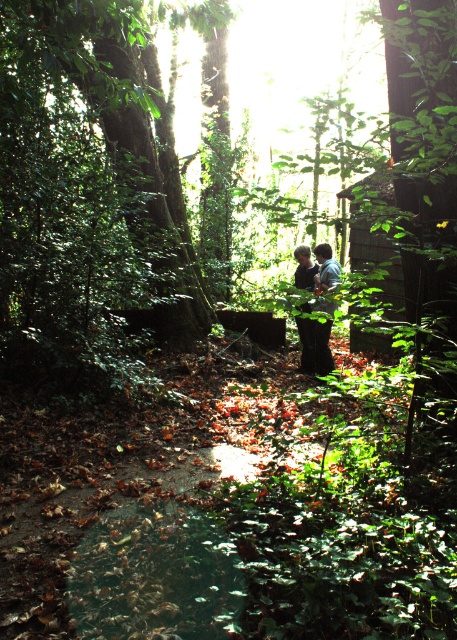
Question: Which point is closer to the camera taking this photo?

Choices:
 (A) (100, 180)
 (B) (298, 268)
 (C) (313, 355)

Answer: (A)

Question: Which object is positioned farthest from the dark blue jeans at center?

Choices:
 (A) green leafy tree at center
 (B) black matte dress at center

Answer: (A)

Question: Which object is the farthest from the green leafy tree at center?

Choices:
 (A) dark blue jeans at center
 (B) black matte dress at center

Answer: (A)

Question: Considering the relative positions of green leafy tree at center and dark blue jeans at center in the image provided, where is green leafy tree at center located with respect to dark blue jeans at center?

Choices:
 (A) right
 (B) left

Answer: (B)

Question: Does black matte dress at center have a greater width compared to dark blue jeans at center?

Choices:
 (A) yes
 (B) no

Answer: (A)

Question: Is green leafy tree at center to the right of dark blue jeans at center from the viewer's perspective?

Choices:
 (A) yes
 (B) no

Answer: (B)